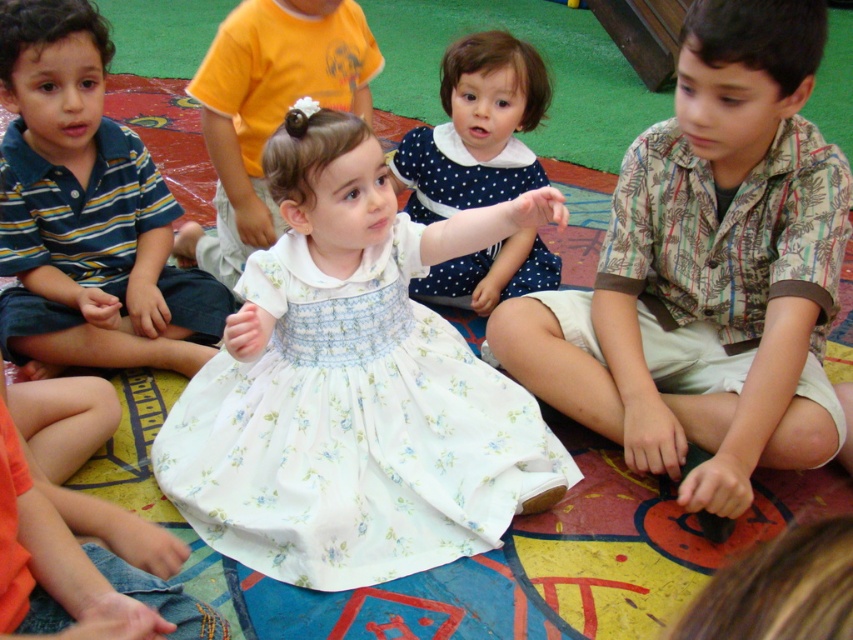
Is striped cotton shirt at left to the right of matte yellow shirt at center from the viewer's perspective?

No, striped cotton shirt at left is not to the right of matte yellow shirt at center.

Which of these two, striped cotton shirt at left or matte yellow shirt at center, stands shorter?

With less height is matte yellow shirt at center.

Is point (44, 193) closer to viewer compared to point (196, 252)?

Yes, point (44, 193) is closer to viewer.

Locate an element on the screen. The width and height of the screenshot is (853, 640). striped cotton shirt at left is located at coordinates pos(86,212).

Between point (705, 484) and point (258, 132), which one is positioned behind?

The point (258, 132) is more distant.

Based on the photo, can you confirm if printed cotton shirt at center is shorter than matte yellow shirt at center?

No.

Which is in front, point (762, 161) or point (244, 256)?

Point (762, 161) is more forward.

The height and width of the screenshot is (640, 853). I want to click on printed cotton shirt at center, so click(706, 269).

Based on the photo, can you confirm if white floral dress at center is thinner than striped cotton shirt at left?

No, white floral dress at center is not thinner than striped cotton shirt at left.

Can you confirm if white floral dress at center is smaller than striped cotton shirt at left?

Incorrect, white floral dress at center is not smaller in size than striped cotton shirt at left.

The width and height of the screenshot is (853, 640). In order to click on white floral dress at center in this screenshot , I will do `click(352, 429)`.